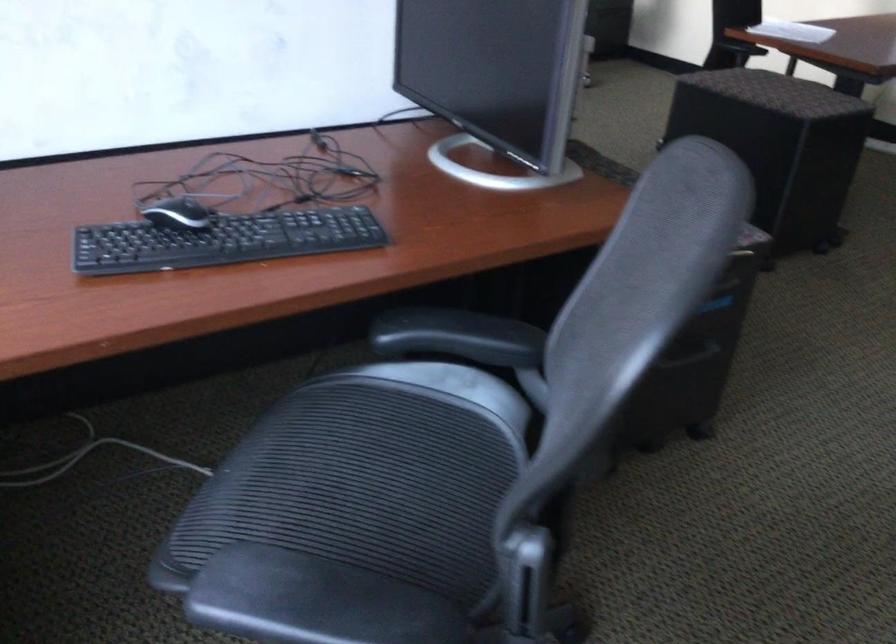
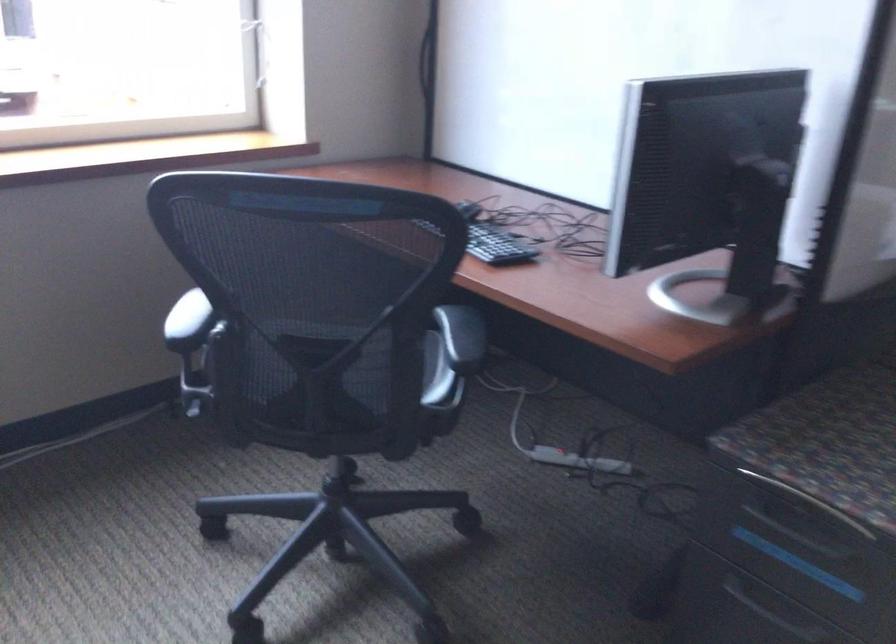
Find the pixel in the second image that matches (694,353) in the first image.

(778, 614)